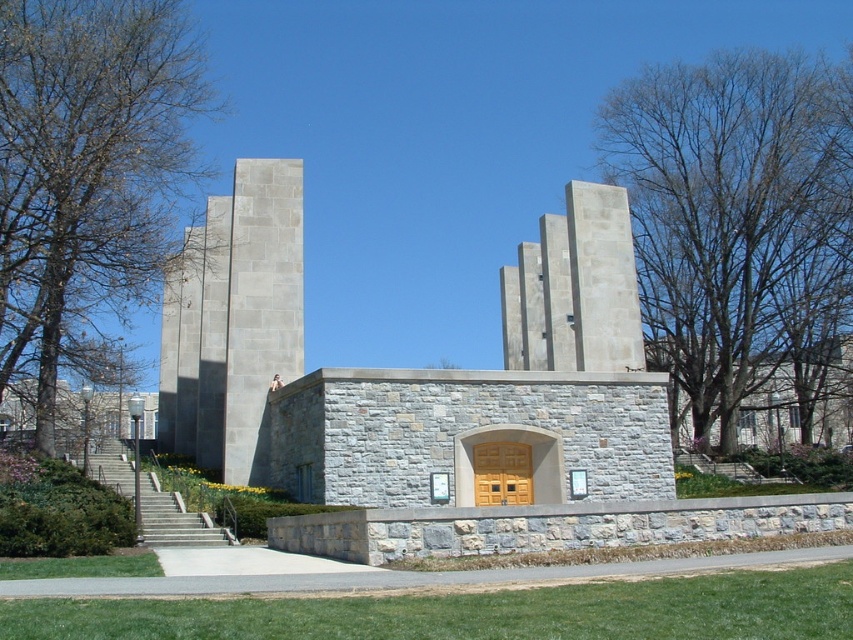
You are standing in front of the modern architectural structure. You see the gray stone tower at center and the light beige stone tower at center. Which one is positioned to the left side?

The gray stone tower at center is to the left of the light beige stone tower at center, so the gray stone tower at center is positioned to the left side.

You are an architect evaluating the structural integrity of the two towers in the image. Given that the gray stone tower at center is wider than the light beige stone tower at center, which tower would you expect to have a stronger foundation?

The gray stone tower at center has a larger width than the light beige stone tower at center, so it would require a stronger foundation to support its greater mass and structural demands.